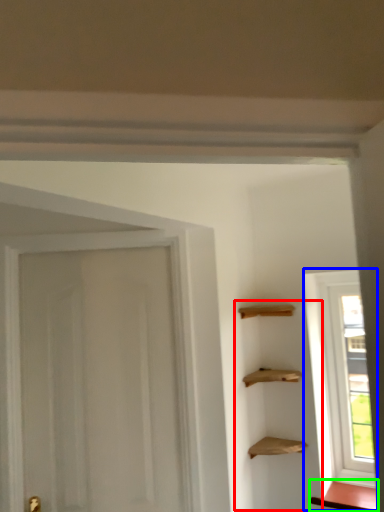
Question: Which is farther away from cabinetry (highlighted by a red box)? window (highlighted by a blue box) or cabinetry (highlighted by a green box)?

Choices:
 (A) window
 (B) cabinetry

Answer: (B)